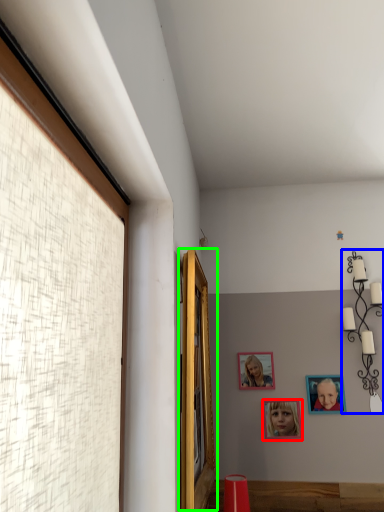
Question: Which object is the closest to the picture frame (highlighted by a red box)? Choose among these: lamp (highlighted by a blue box) or window (highlighted by a green box).

Choices:
 (A) lamp
 (B) window

Answer: (A)